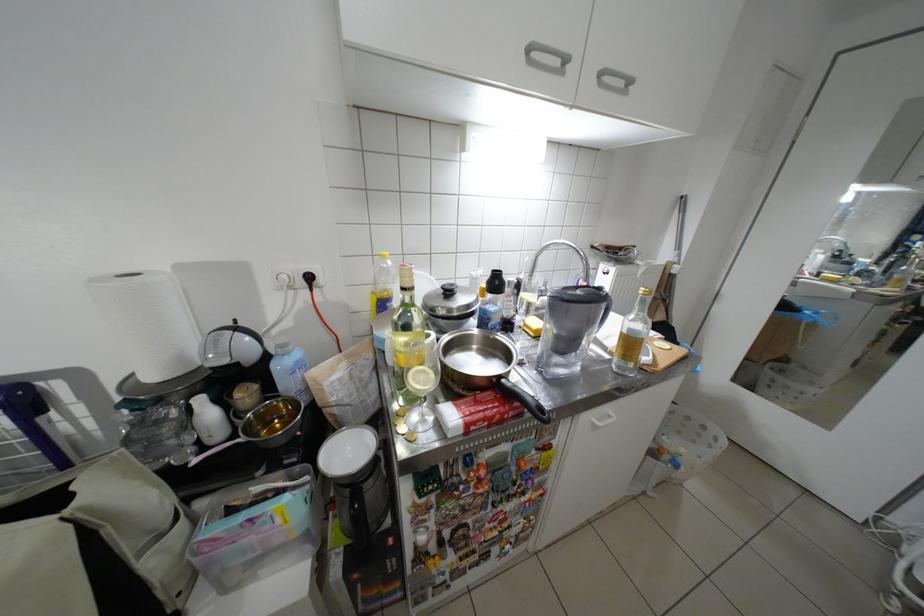
Find where to pull the paper towel roll. Please return your answer as a coordinate pair (x, y).

(148, 322)